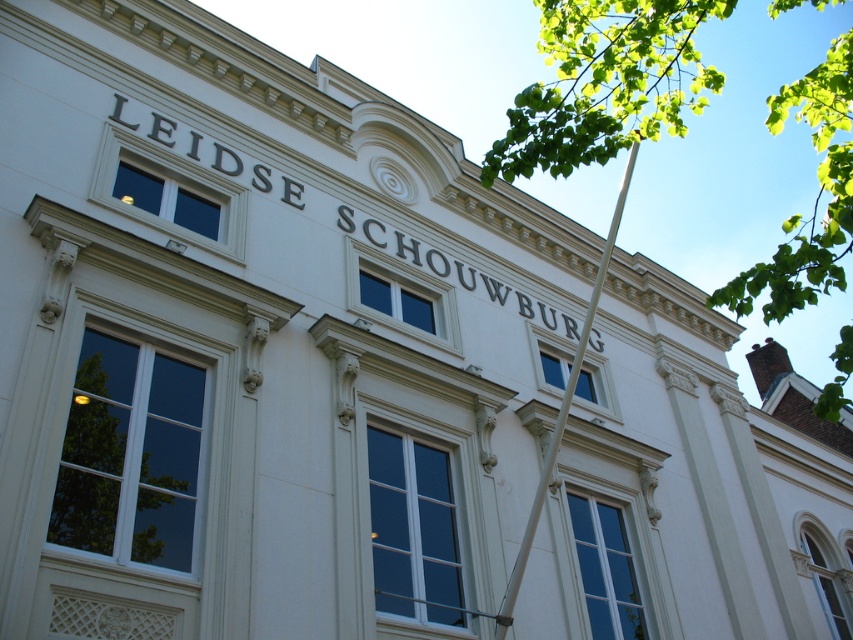
Question: Where is green leafy tree at lower left located in relation to white metallic pole at upper right in the image?

Choices:
 (A) left
 (B) right

Answer: (A)

Question: Among these points, which one is nearest to the camera?

Choices:
 (A) (167, 460)
 (B) (601, 0)

Answer: (B)

Question: Does green leafy tree at lower left appear on the right side of white metallic pole at upper right?

Choices:
 (A) yes
 (B) no

Answer: (B)

Question: Which of the following is the farthest from the observer?

Choices:
 (A) (561, 413)
 (B) (814, 204)
 (C) (102, 545)

Answer: (B)

Question: Can you confirm if green leafy tree at upper right is thinner than white metallic pole at upper right?

Choices:
 (A) yes
 (B) no

Answer: (B)

Question: Among these objects, which one is nearest to the camera?

Choices:
 (A) white metallic pole at upper right
 (B) green leafy tree at upper right

Answer: (B)